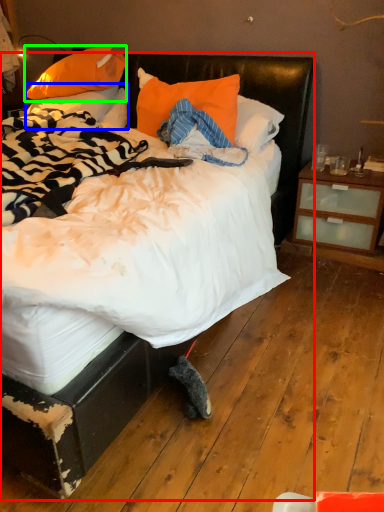
Question: Considering the real-world distances, which object is closest to bed (highlighted by a red box)? pillow (highlighted by a blue box) or pillow (highlighted by a green box).

Choices:
 (A) pillow
 (B) pillow

Answer: (A)